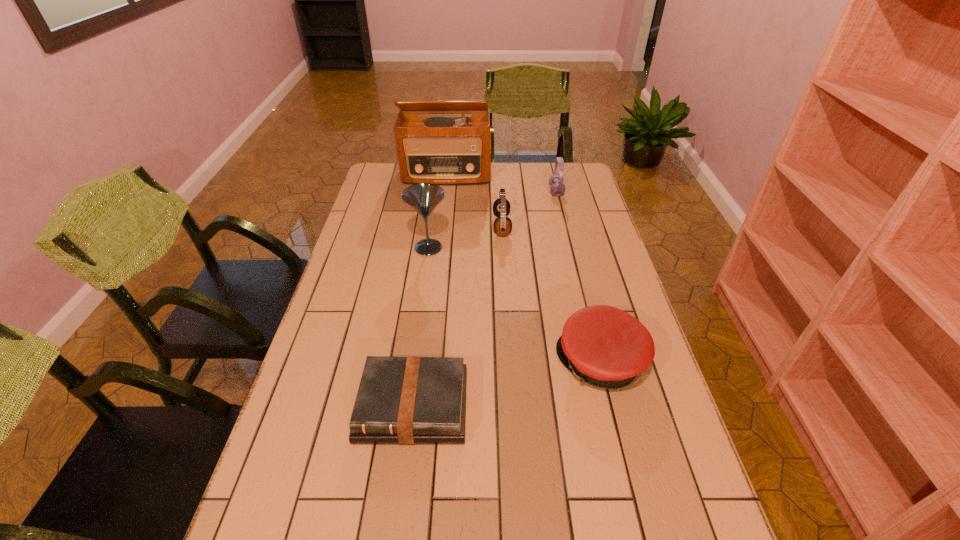
Identify the location of radio receiver that is at the left edge. (443, 150).

Locate an element on the screen. hardback book located in the left edge section of the desktop is located at coordinates (410, 400).

This screenshot has width=960, height=540. In order to click on headset that is at the right edge in this screenshot , I will do `click(557, 188)`.

The image size is (960, 540). In order to click on cap that is at the right edge in this screenshot , I will do `click(606, 347)`.

At what (x,y) coordinates should I click in order to perform the action: click on object that is at the far left corner. Please return your answer as a coordinate pair (x, y). This screenshot has width=960, height=540. Looking at the image, I should click on (443, 150).

Locate an element on the screen. The image size is (960, 540). object present at the far right corner is located at coordinates (557, 188).

Locate an element on the screen. The height and width of the screenshot is (540, 960). free space at the far edge of the desktop is located at coordinates (520, 184).

I want to click on vacant region at the left edge of the desktop, so click(x=343, y=347).

You are a GUI agent. You are given a task and a screenshot of the screen. Output one action in this format:
    pyautogui.click(x=<x>, y=<y>)
    Task: Click on the free location at the right edge of the desktop
    The image size is (960, 540).
    Given the screenshot: What is the action you would take?
    pyautogui.click(x=622, y=460)

Find the location of a particular element. The image size is (960, 540). vacant point located between the martini and the shortest object is located at coordinates (420, 327).